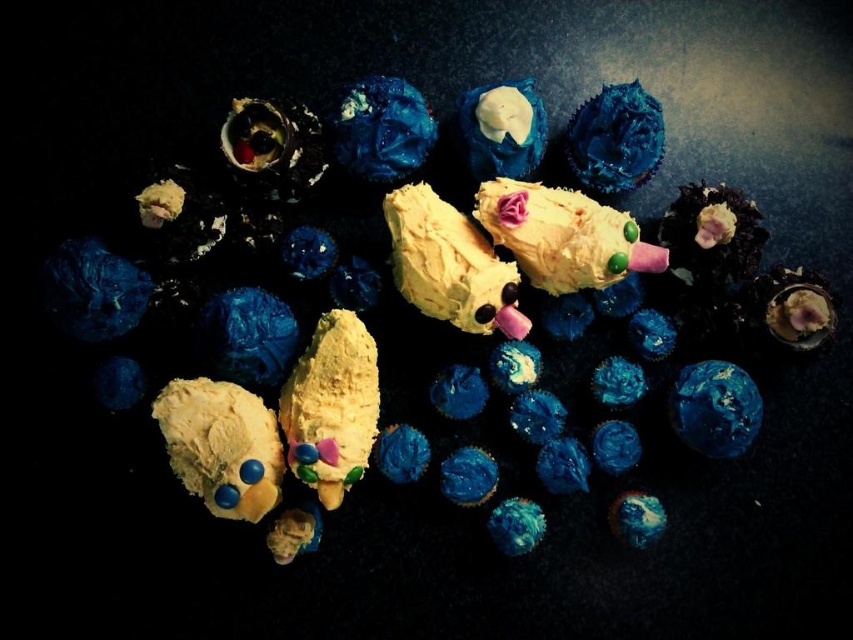
Does matte blue cupcake at upper center have a greater height compared to satin blue cupcake at upper center?

Indeed, matte blue cupcake at upper center has a greater height compared to satin blue cupcake at upper center.

Between matte blue cupcake at upper center and satin blue cupcake at upper center, which one appears on the right side from the viewer's perspective?

Positioned to the right is satin blue cupcake at upper center.

Is point (347, 152) positioned behind point (592, 136)?

Yes, point (347, 152) is farther from viewer.

You are a GUI agent. You are given a task and a screenshot of the screen. Output one action in this format:
    pyautogui.click(x=<x>, y=<y>)
    Task: Click on the matte blue cupcake at upper center
    Image resolution: width=853 pixels, height=640 pixels.
    Given the screenshot: What is the action you would take?
    pyautogui.click(x=381, y=129)

Does matte yellow duck at center have a lesser height compared to yellow matte duckling at center?

No, matte yellow duck at center is not shorter than yellow matte duckling at center.

Is point (459, 481) farther from viewer compared to point (418, 278)?

Yes, it is.

This screenshot has width=853, height=640. Find the location of `matte yellow duck at center`. matte yellow duck at center is located at coordinates (409, 324).

In the scene shown: Who is positioned more to the left, matte yellow plush toy at center or yellow matte duckling at center?

Positioned to the left is matte yellow plush toy at center.

From the picture: Can you confirm if matte yellow plush toy at center is positioned below yellow matte duckling at center?

Correct, matte yellow plush toy at center is located below yellow matte duckling at center.

Identify the location of matte yellow plush toy at center. This screenshot has height=640, width=853. (221, 445).

Image resolution: width=853 pixels, height=640 pixels. What are the coordinates of `matte yellow plush toy at center` in the screenshot? It's located at (221, 445).